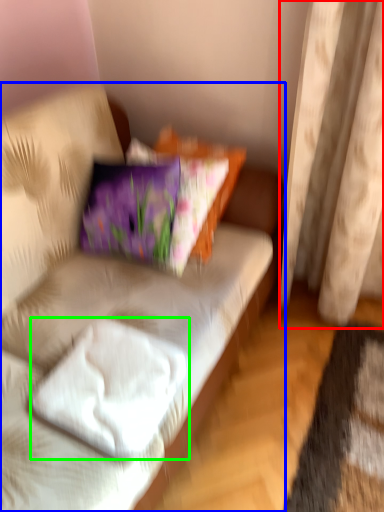
Question: Based on their relative distances, which object is farther from curtain (highlighted by a red box)? Choose from studio couch (highlighted by a blue box) and pillow (highlighted by a green box).

Choices:
 (A) studio couch
 (B) pillow

Answer: (B)